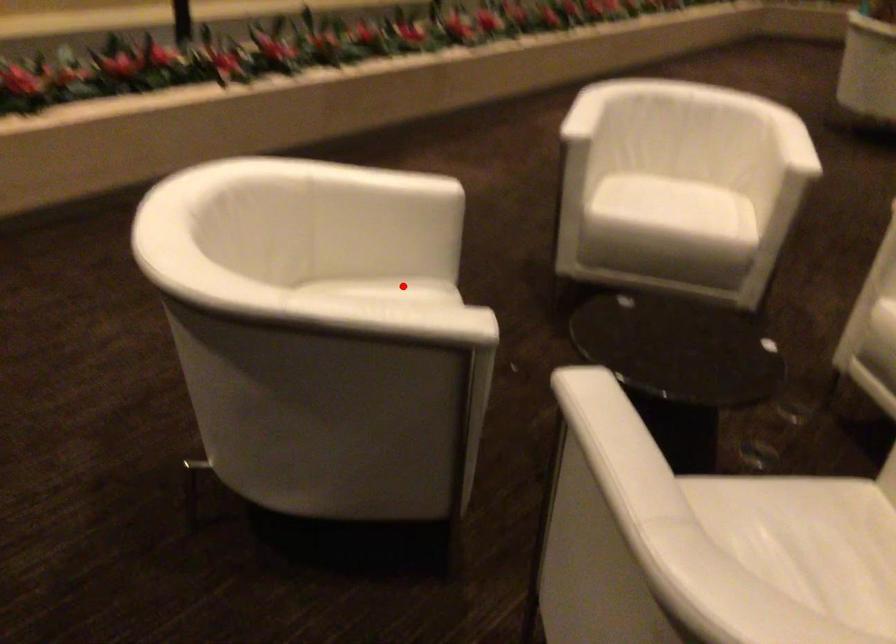
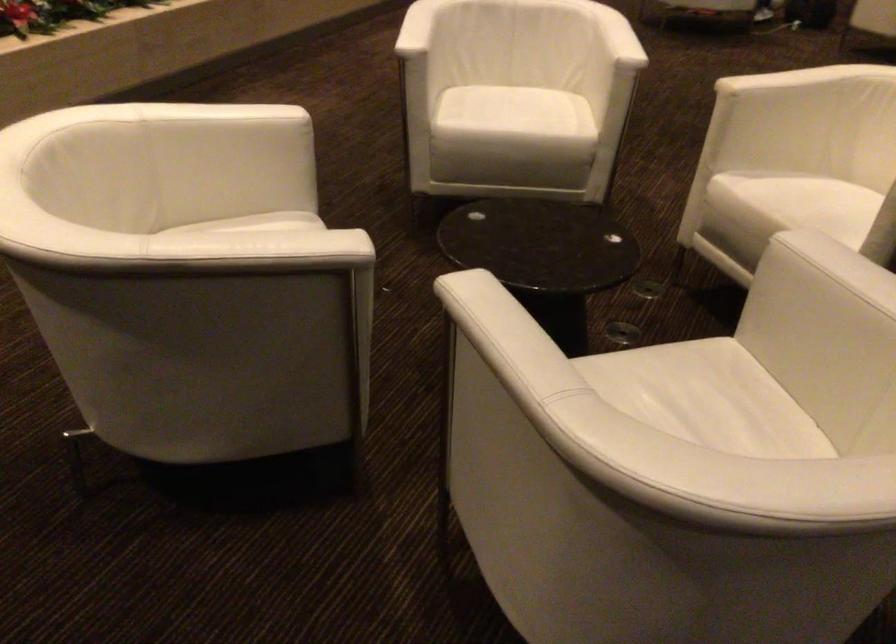
Find the pixel in the second image that matches the highlighted location in the first image.

(265, 223)